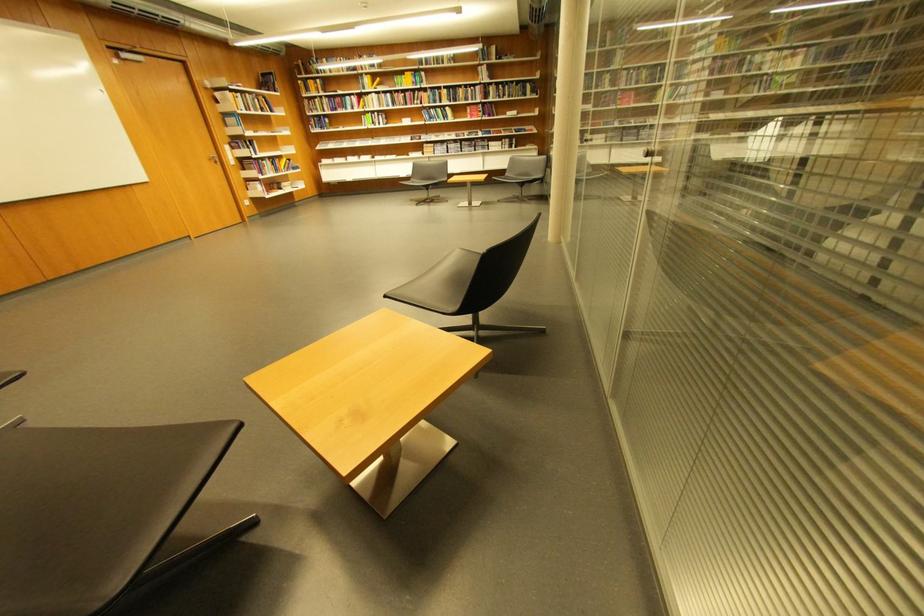
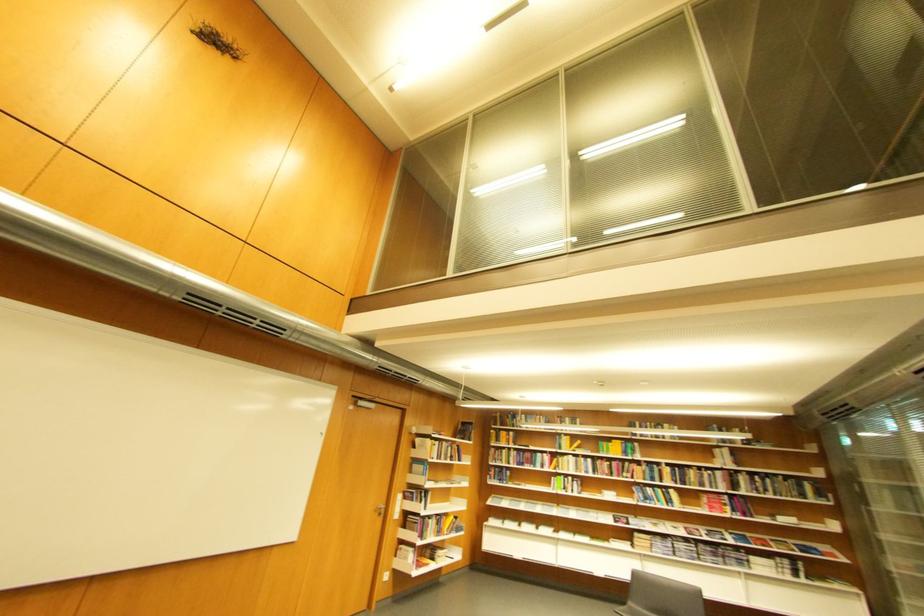
Find the pixel in the second image that matches point 273,113 in the first image.

(460, 461)